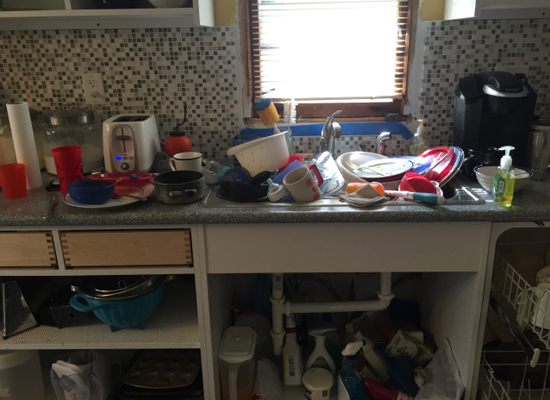
Locate an element on the screen. This screenshot has width=550, height=400. plate is located at coordinates (446, 164), (456, 163), (372, 175), (345, 159), (115, 200), (131, 181).